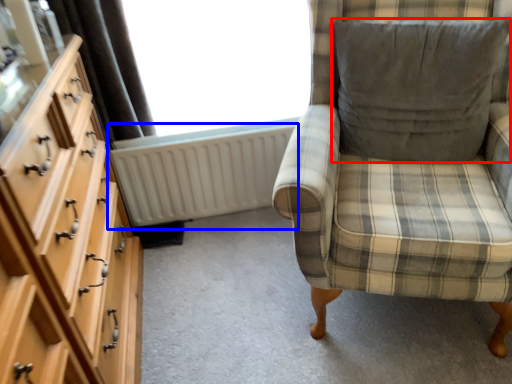
Question: Which point is closer to the camera, pillow (highlighted by a red box) or radiator (highlighted by a blue box)?

Choices:
 (A) pillow
 (B) radiator

Answer: (A)